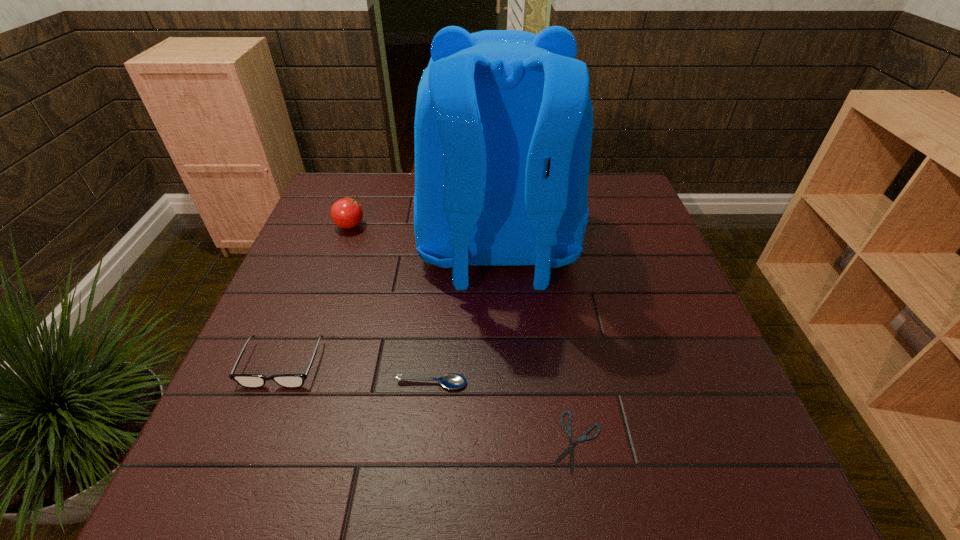
Where is `the tallest object`? The image size is (960, 540). the tallest object is located at coordinates (503, 127).

I want to click on apple, so click(x=347, y=213).

The height and width of the screenshot is (540, 960). I want to click on the third shortest object, so click(245, 380).

Where is `soupspoon`? soupspoon is located at coordinates (451, 381).

You are a GUI agent. You are given a task and a screenshot of the screen. Output one action in this format:
    pyautogui.click(x=<x>, y=<y>)
    Task: Click on the nearest object
    This screenshot has width=960, height=540.
    Given the screenshot: What is the action you would take?
    pyautogui.click(x=568, y=430)

Locate an element on the screen. the shortest object is located at coordinates (568, 430).

Locate an element on the screen. The image size is (960, 540). vacant space located on the back of the backpack is located at coordinates (506, 423).

Where is `vacant space situated on the back of the apple`? The width and height of the screenshot is (960, 540). vacant space situated on the back of the apple is located at coordinates (362, 193).

This screenshot has height=540, width=960. Identify the location of vacant point located on the front-facing side of the third shortest object. (244, 460).

The width and height of the screenshot is (960, 540). What are the coordinates of `vacant space located 0.400m on the right of the second shortest object` in the screenshot? It's located at (669, 383).